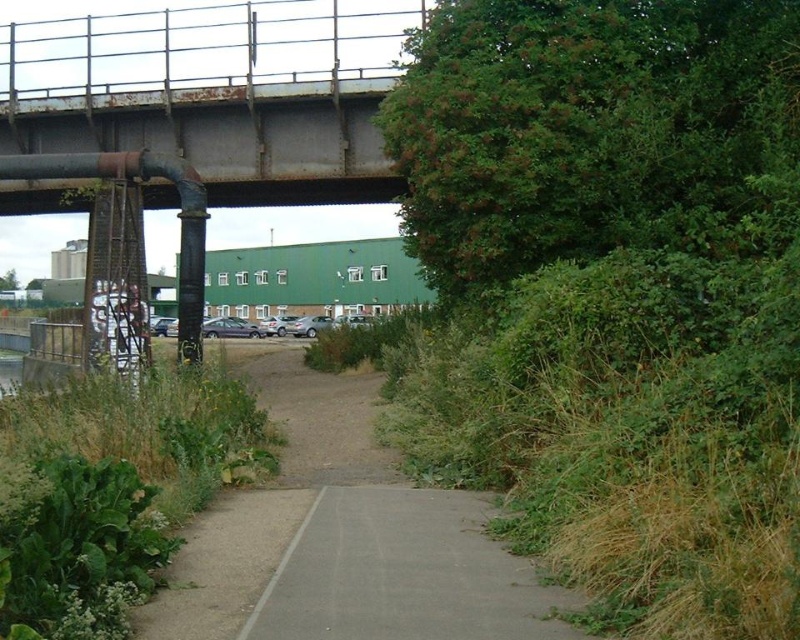
Question: Is dull gray concrete path at center bigger than rusty metal bridge at upper center?

Choices:
 (A) no
 (B) yes

Answer: (A)

Question: Among these objects, which one is nearest to the camera?

Choices:
 (A) green leafy bush at upper right
 (B) rusty metal bridge at upper center

Answer: (A)

Question: Is green leafy bush at upper right further to the viewer compared to dull gray concrete path at center?

Choices:
 (A) no
 (B) yes

Answer: (A)

Question: Does green leafy bush at upper right have a greater width compared to dull gray concrete path at center?

Choices:
 (A) no
 (B) yes

Answer: (B)

Question: Which is nearer to the rusty metal bridge at upper center?

Choices:
 (A) green leafy bush at upper right
 (B) dull gray concrete path at center

Answer: (B)

Question: Among these objects, which one is farthest from the camera?

Choices:
 (A) dull gray concrete path at center
 (B) rusty metal bridge at upper center
 (C) green leafy bush at upper right

Answer: (B)